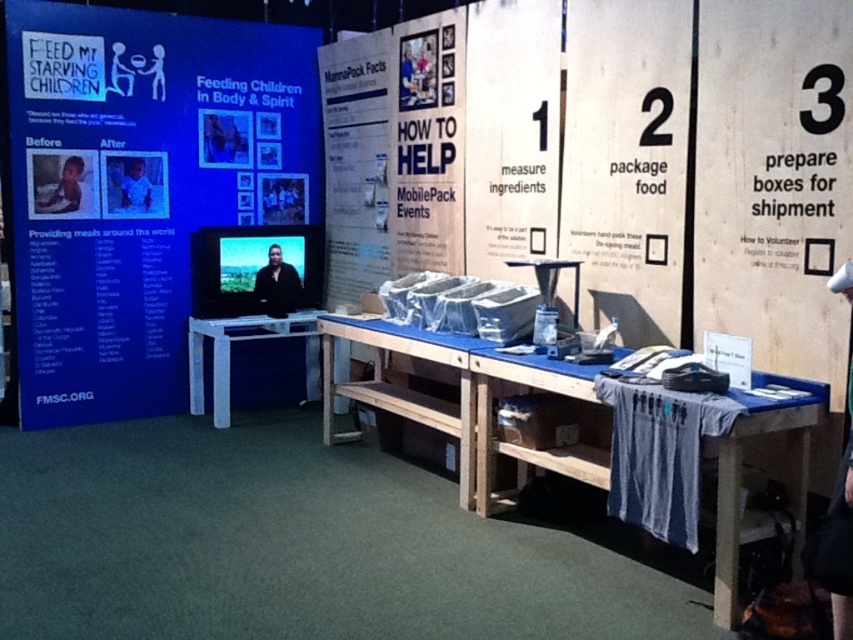
Is blue cardboard poster at left thinner than white plastic table at lower left?

No, blue cardboard poster at left is not thinner than white plastic table at lower left.

Is blue cardboard poster at left shorter than white plastic table at lower left?

No.

Who is more distant from viewer, (265, 144) or (215, 378)?

Point (265, 144)

Find the location of a particular element. blue cardboard poster at left is located at coordinates (149, 182).

Which is below, blue fabric-covered table at lower right or white plastic table at lower left?

Positioned lower is blue fabric-covered table at lower right.

Between blue fabric-covered table at lower right and white plastic table at lower left, which one appears on the left side from the viewer's perspective?

white plastic table at lower left

The width and height of the screenshot is (853, 640). I want to click on blue fabric-covered table at lower right, so click(x=740, y=483).

Does white paper at center appear under wooden table at center?

No.

Who is more forward, [463,19] or [335,316]?

Positioned in front is point [463,19].

The image size is (853, 640). I want to click on white paper at center, so click(x=428, y=145).

Find the location of a particular element. white paper at center is located at coordinates (428, 145).